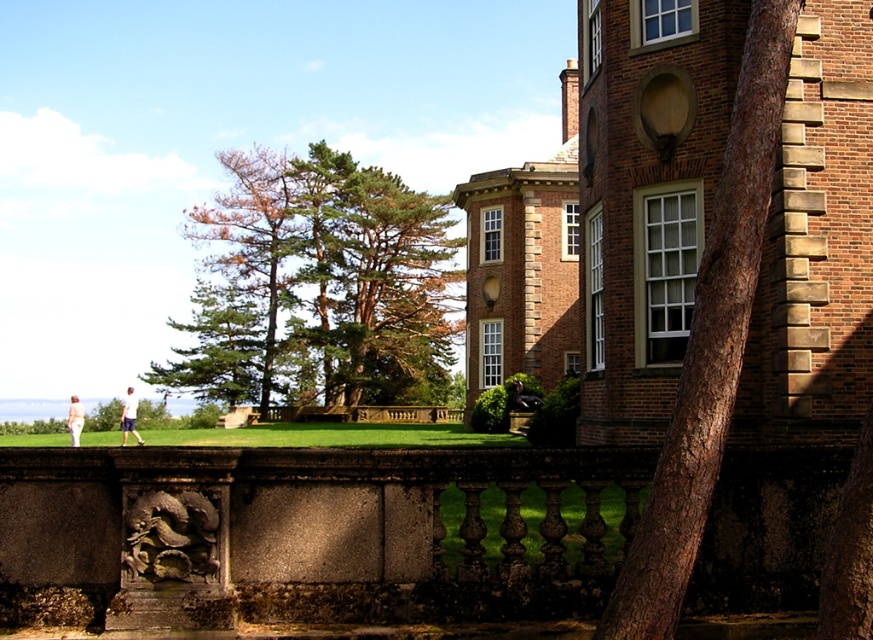
Does green needle-like foliage at center have a greater width compared to pink fabric pants at lower left?

No, green needle-like foliage at center is not wider than pink fabric pants at lower left.

The height and width of the screenshot is (640, 873). What do you see at coordinates (318, 284) in the screenshot?
I see `green needle-like foliage at center` at bounding box center [318, 284].

Between point (208, 259) and point (74, 436), which one is positioned behind?

The point (208, 259) is more distant.

Locate an element on the screen. This screenshot has width=873, height=640. green needle-like foliage at center is located at coordinates (318, 284).

Is green needle-like foliage at center further to camera compared to white cotton shirt at lower left?

That is True.

Measure the distance from green needle-like foliage at center to white cotton shirt at lower left.

green needle-like foliage at center is 22.50 meters away from white cotton shirt at lower left.

This screenshot has height=640, width=873. Identify the location of green needle-like foliage at center. 318,284.

Between green needle-like foliage at center and matte black statue at lower center, which one has less height?

Standing shorter between the two is matte black statue at lower center.

Does green needle-like foliage at center appear on the right side of matte black statue at lower center?

Incorrect, green needle-like foliage at center is not on the right side of matte black statue at lower center.

At what (x,y) coordinates should I click in order to perform the action: click on green needle-like foliage at center. Please return your answer as a coordinate pair (x, y). This screenshot has height=640, width=873. Looking at the image, I should click on 318,284.

The width and height of the screenshot is (873, 640). Find the location of `green needle-like foliage at center`. green needle-like foliage at center is located at coordinates (318, 284).